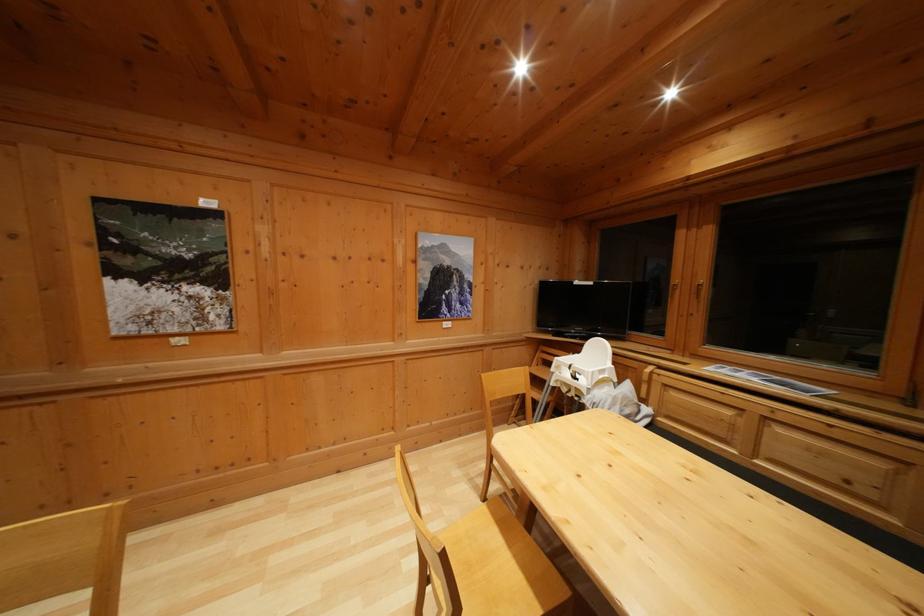
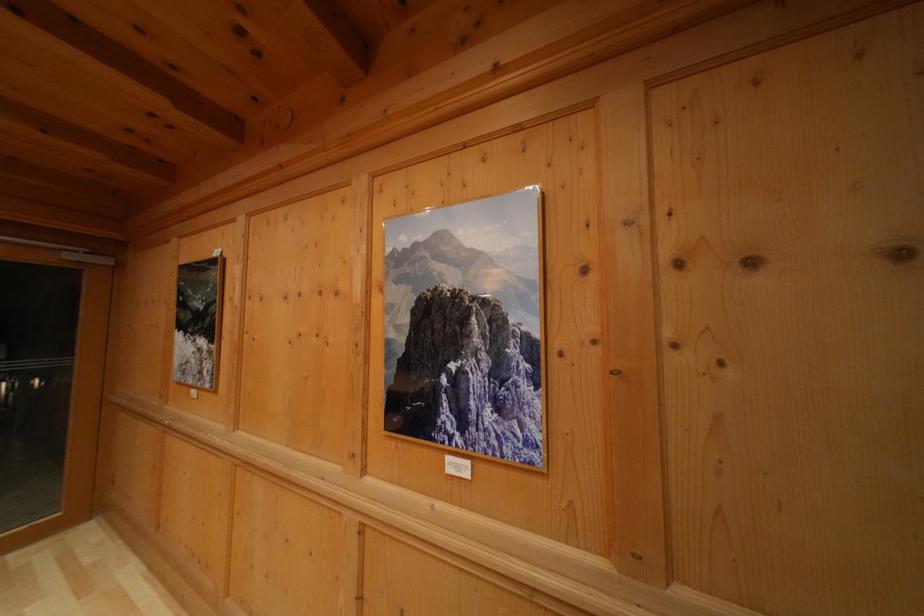
Where in the second image is the point corresponding to the point at 441,251 from the first image?

(427, 245)